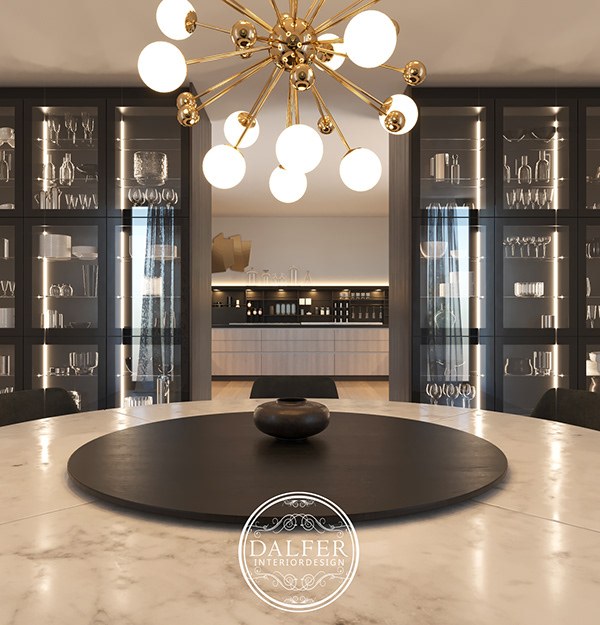
I want to click on ceiling, so pos(457,50).